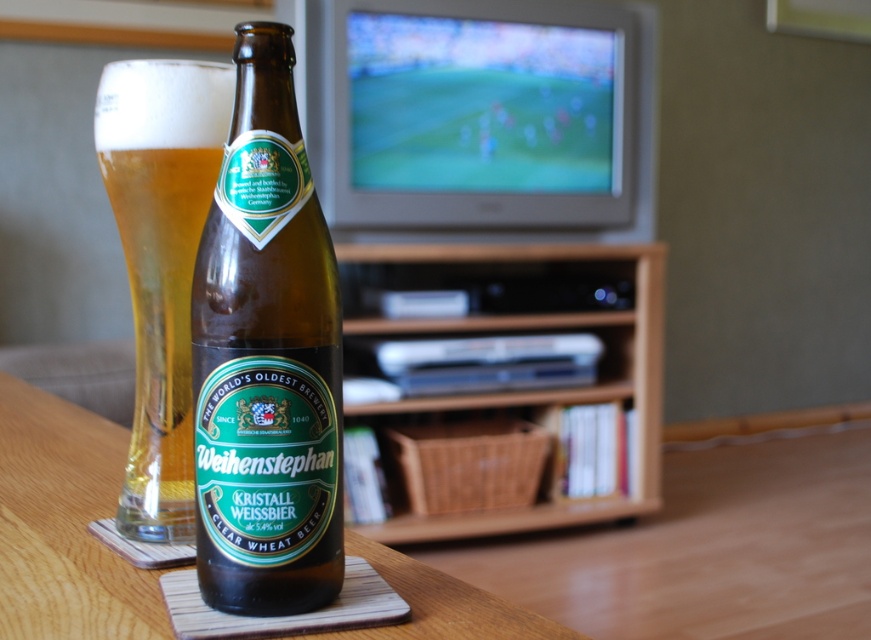
You are at a bar and want to place your clear glass beer at center on the wooden coaster at center. Is the coaster large enough to hold the glass without it tipping over?

The wooden coaster at center is below clear glass beer at center, so it is large enough to support the glass without tipping over.

You are placing a Weihenstephan Kristall Weissbier bottle on the wooden coaster at center. If you want to ensure the bottle is visible from the front of the wooden entertainment center at center, is the coaster positioned correctly?

The wooden coaster at center is in front of the wooden entertainment center at center, so placing the bottle on it would block the view from the front. Move the coaster to a position behind the entertainment center to make the bottle visible from the front.

You are a delivery person who needs to place a new Weihenstephan Kristall Weissbier bottle on the table. The existing bottle is at point (267,356). Where should you place the new bottle to avoid overlapping with the existing one?

Place the new bottle away from the point (267,356) where the brown glass beer bottle at center is located to avoid overlapping.